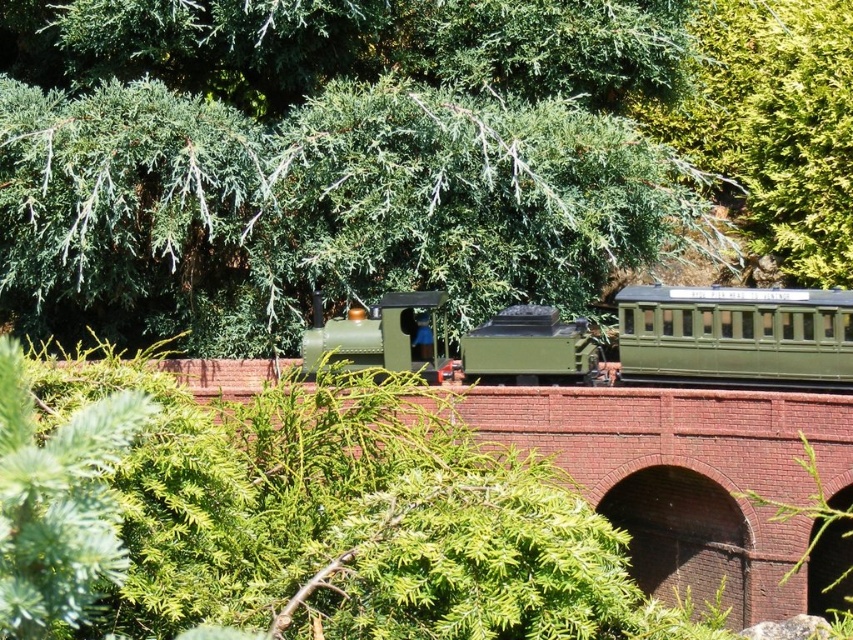
Question: Which point is farther to the camera?

Choices:
 (A) green matte steam train at center
 (B) green leafy tree at upper center

Answer: (A)

Question: Where is green leafy tree at upper center located in relation to green matte steam train at center in the image?

Choices:
 (A) right
 (B) left

Answer: (B)

Question: Does green leafy tree at upper center appear on the left side of green matte steam train at center?

Choices:
 (A) no
 (B) yes

Answer: (B)

Question: In this image, where is green leafy tree at upper center located relative to green matte steam train at center?

Choices:
 (A) above
 (B) below

Answer: (A)